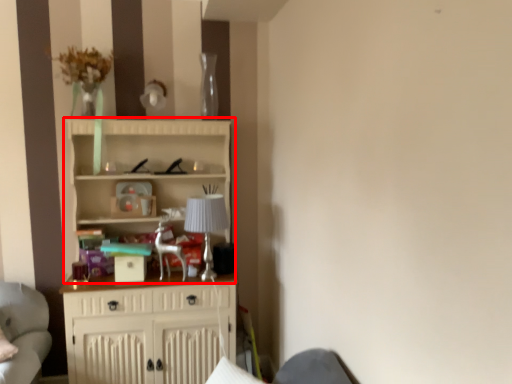
Question: From the image, what is the correct spatial relationship of cupboard (annotated by the red box) in relation to lamp?

Choices:
 (A) right
 (B) left

Answer: (B)